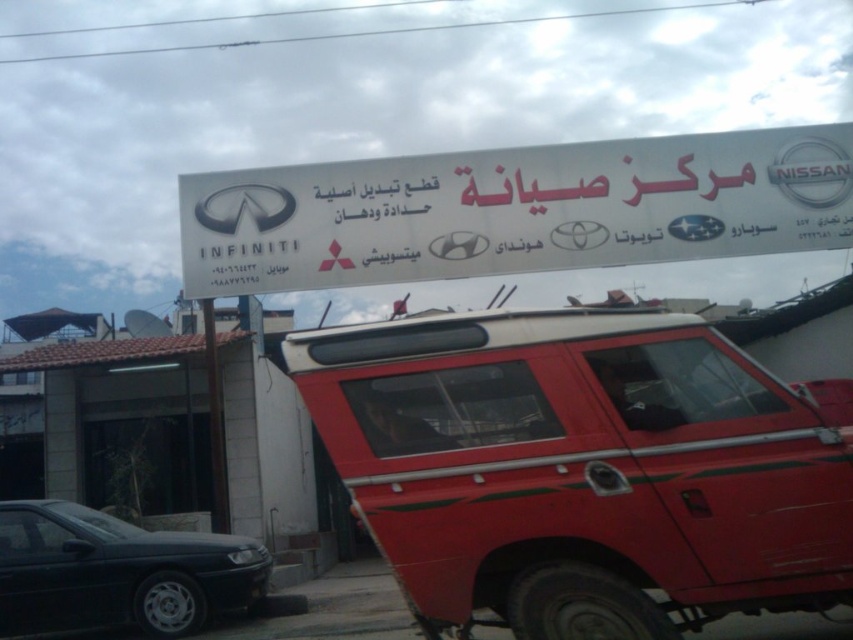
You are standing at the entrance of the car dealership and see a point marked at coordinates [583,468]. Which vehicle is this point located on?

The point at [583,468] is located on the shiny red jeep at center.

You are a customer looking to rent a vehicle. You see a shiny red jeep at center and a matte black sedan at lower left. Which vehicle would you choose if you need more space for luggage?

The shiny red jeep at center is larger in size than the matte black sedan at lower left, so it would provide more space for luggage.

You are standing in front of the car dealership signboard. There is a shiny red jeep at center and a white plastic sign at center. Which object is nearer to you?

The shiny red jeep at center is closer to the viewer than the white plastic sign at center.